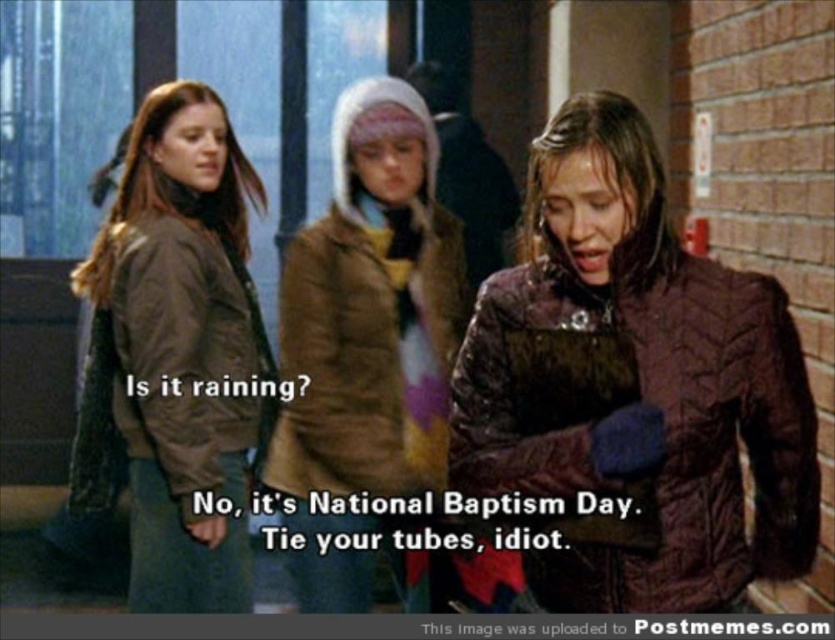
Question: Considering the real-world distances, which object is farthest from the shiny brown jacket at center?

Choices:
 (A) brown quilted coat at center
 (B) brown quilted jacket at left

Answer: (B)

Question: Considering the real-world distances, which object is farthest from the shiny brown jacket at center?

Choices:
 (A) brown quilted jacket at left
 (B) brown quilted coat at center

Answer: (A)

Question: Does shiny brown jacket at center appear on the left side of brown quilted jacket at left?

Choices:
 (A) no
 (B) yes

Answer: (A)

Question: Among these points, which one is nearest to the camera?

Choices:
 (A) (355, 552)
 (B) (682, 310)

Answer: (B)

Question: Is brown quilted jacket at left positioned behind brown quilted coat at center?

Choices:
 (A) yes
 (B) no

Answer: (B)

Question: Is shiny brown jacket at center to the right of brown quilted coat at center from the viewer's perspective?

Choices:
 (A) yes
 (B) no

Answer: (A)